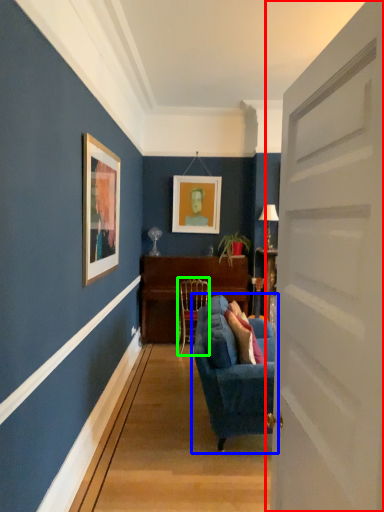
Question: Which is farther away from door (highlighted by a red box)? studio couch (highlighted by a blue box) or chair (highlighted by a green box)?

Choices:
 (A) studio couch
 (B) chair

Answer: (B)